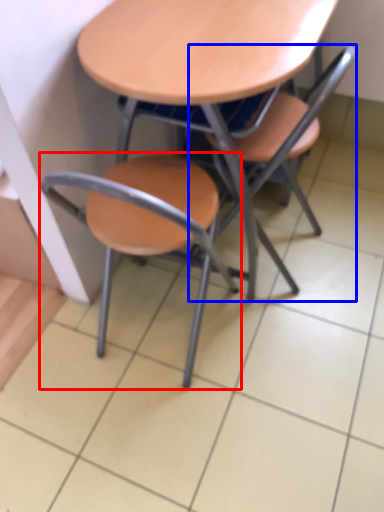
Question: Which object appears farthest to the camera in this image, chair (highlighted by a red box) or chair (highlighted by a blue box)?

Choices:
 (A) chair
 (B) chair

Answer: (B)